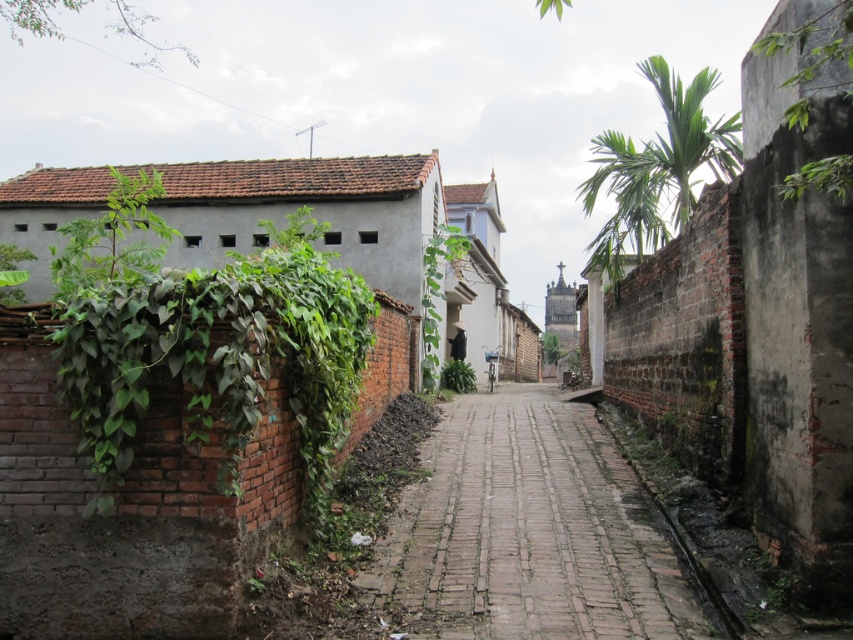
Consider the image. Does green leafy vines at left have a lesser height compared to green leafy palm at upper right?

Indeed, green leafy vines at left has a lesser height compared to green leafy palm at upper right.

The width and height of the screenshot is (853, 640). What do you see at coordinates (206, 339) in the screenshot? I see `green leafy vines at left` at bounding box center [206, 339].

Locate an element on the screen. green leafy vines at left is located at coordinates (206, 339).

Between brick paved path at center and green leafy plant at center, which one has less height?

With less height is brick paved path at center.

Describe the element at coordinates (526, 532) in the screenshot. I see `brick paved path at center` at that location.

The image size is (853, 640). In order to click on brick paved path at center in this screenshot , I will do `click(526, 532)`.

Measure the distance between brick paved path at center and green leafy palm at upper right.

A distance of 12.66 meters exists between brick paved path at center and green leafy palm at upper right.

In the scene shown: Can you confirm if brick paved path at center is shorter than green leafy palm at upper right?

Correct, brick paved path at center is not as tall as green leafy palm at upper right.

Between point (523, 602) and point (583, 202), which one is positioned in front?

Positioned in front is point (523, 602).

Locate an element on the screen. Image resolution: width=853 pixels, height=640 pixels. brick paved path at center is located at coordinates (526, 532).